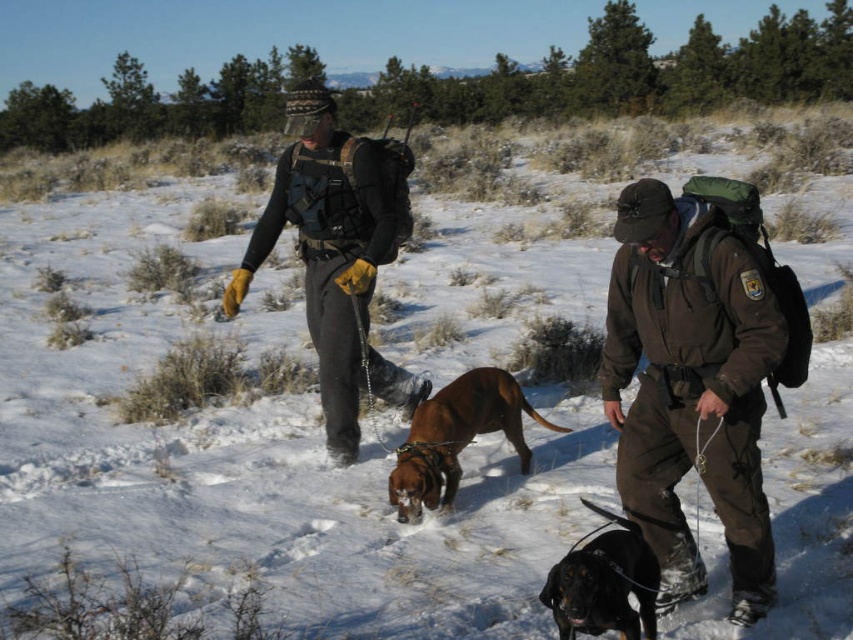
Which of these two, dark gray pants at center or black smooth dog at lower center, stands shorter?

Standing shorter between the two is black smooth dog at lower center.

What do you see at coordinates (331, 243) in the screenshot?
I see `dark gray pants at center` at bounding box center [331, 243].

Locate an element on the screen. dark gray pants at center is located at coordinates (331, 243).

Can you confirm if brown matte uniform at center is positioned above black smooth dog at lower center?

Yes, brown matte uniform at center is above black smooth dog at lower center.

Does brown matte uniform at center have a greater width compared to black smooth dog at lower center?

Indeed, brown matte uniform at center has a greater width compared to black smooth dog at lower center.

Who is more distant from viewer, (685, 269) or (612, 516)?

The point (685, 269) is behind.

The width and height of the screenshot is (853, 640). I want to click on brown matte uniform at center, so click(x=691, y=385).

Between point (679, 371) and point (496, 406), which one is positioned in front?

Point (679, 371)

The height and width of the screenshot is (640, 853). What do you see at coordinates (691, 385) in the screenshot? I see `brown matte uniform at center` at bounding box center [691, 385].

Does point (660, 442) come closer to viewer compared to point (409, 480)?

Yes, point (660, 442) is in front of point (409, 480).

This screenshot has height=640, width=853. I want to click on brown matte uniform at center, so click(x=691, y=385).